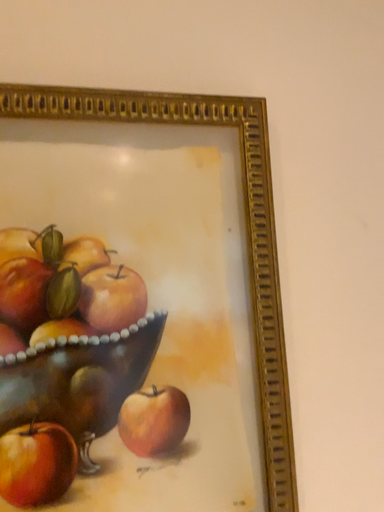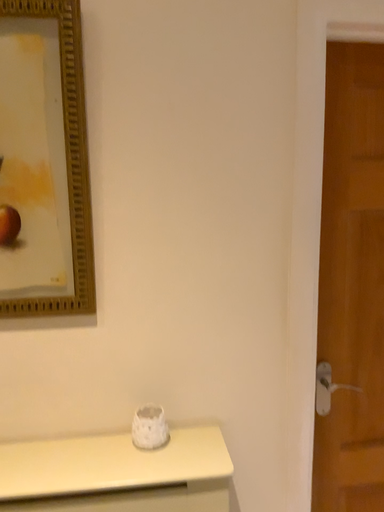
Question: Which way did the camera rotate in the video?

Choices:
 (A) rotated right
 (B) rotated left

Answer: (B)